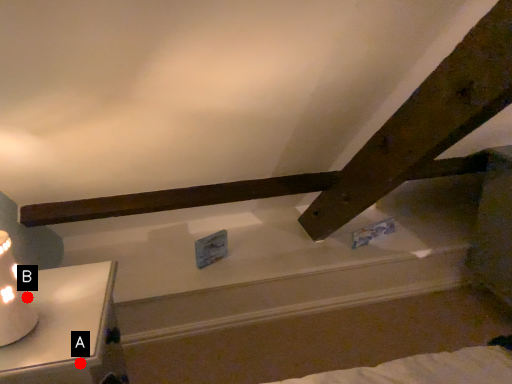
Question: Two points are circled on the image, labeled by A and B beside each circle. Which of the following is the farthest from the observer?

Choices:
 (A) A is further
 (B) B is further

Answer: (B)